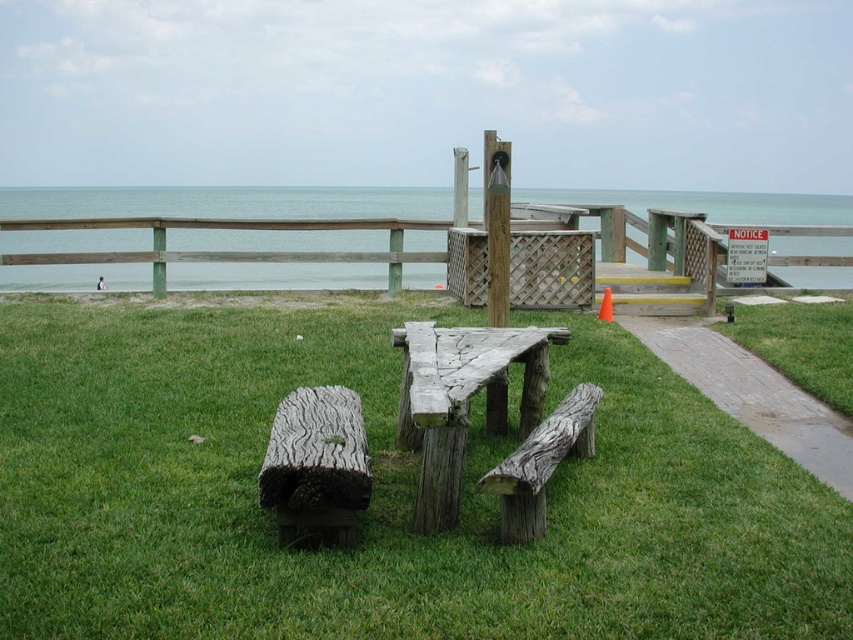
You are planning to set up a small tent between the blue water at upper center and the weathered wood bench at center. Based on their widths, which object should you place the tent closer to in order to ensure it fits properly?

The blue water at upper center is wider than the weathered wood bench at center. Therefore, placing the tent closer to the blue water at upper center would provide more space for it to fit properly.

You are planning to walk from the picnic table towards the wooden deck. There is a brick paved path at lower right and a weathered wood bench at center in your way. Which object should you avoid stepping on to stay on the path?

You should avoid stepping on the weathered wood bench at center because the brick paved path at lower right is to its right, meaning the bench is off the path and staying on the path would require bypassing it.

Based on the photo, you are a park ranger who needs to place a 3 meter long safety barrier between the blue water at upper center and the weathered wood bench at center. Is there enough space to place it without moving either object?

The distance between the blue water at upper center and the weathered wood bench at center is 9.53 meters. Since the safety barrier is 3 meters long, there is sufficient space to place it between them without moving either object.